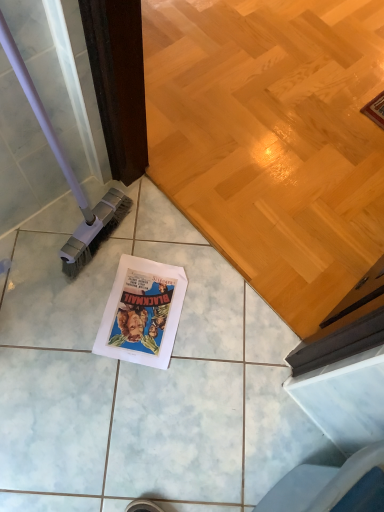
Find the location of a particular element. free region under white paper comic book at center (from a real-world perspective) is located at coordinates pos(146,310).